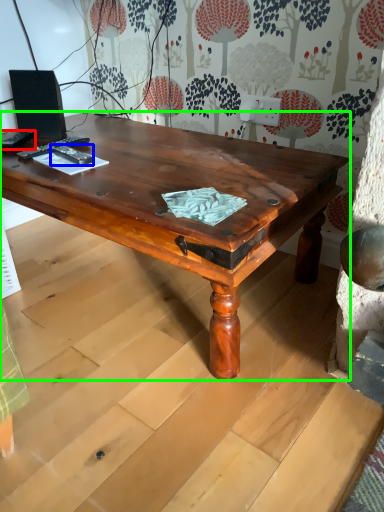
Question: Which object is positioned farthest from remote control (highlighted by a red box)? Select from remote control (highlighted by a blue box) and coffee table (highlighted by a green box).

Choices:
 (A) remote control
 (B) coffee table

Answer: (B)